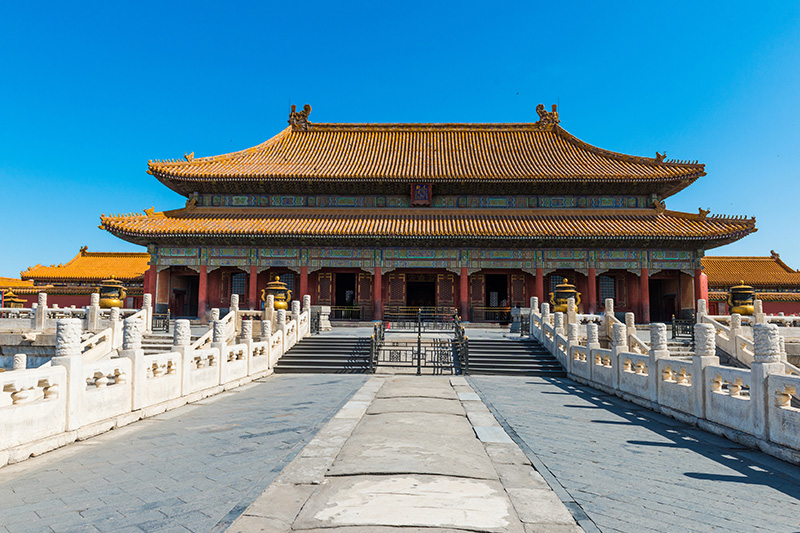
Find the location of a particular element. sliding doors is located at coordinates (322, 282), (361, 286), (396, 290), (456, 290), (478, 289), (516, 284).